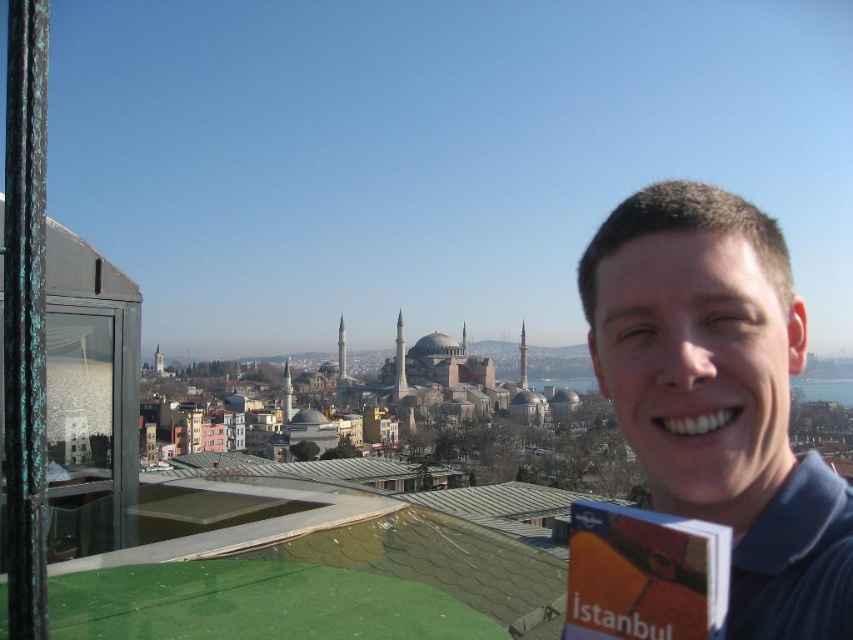
Question: Does blue shirt at right appear over orange paper book at right?

Choices:
 (A) no
 (B) yes

Answer: (B)

Question: Is blue shirt at right closer to the viewer compared to orange paper book at right?

Choices:
 (A) no
 (B) yes

Answer: (B)

Question: Is blue shirt at right positioned before orange paper book at right?

Choices:
 (A) yes
 (B) no

Answer: (A)

Question: Which object is farther from the camera taking this photo?

Choices:
 (A) orange paper book at right
 (B) blue shirt at right

Answer: (A)